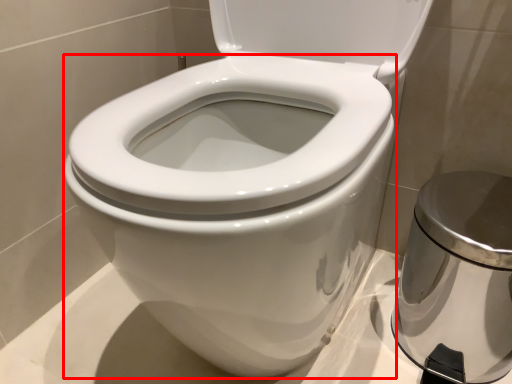
Question: In this image, where is bidet (annotated by the red box) located relative to porcelain?

Choices:
 (A) left
 (B) right

Answer: (A)